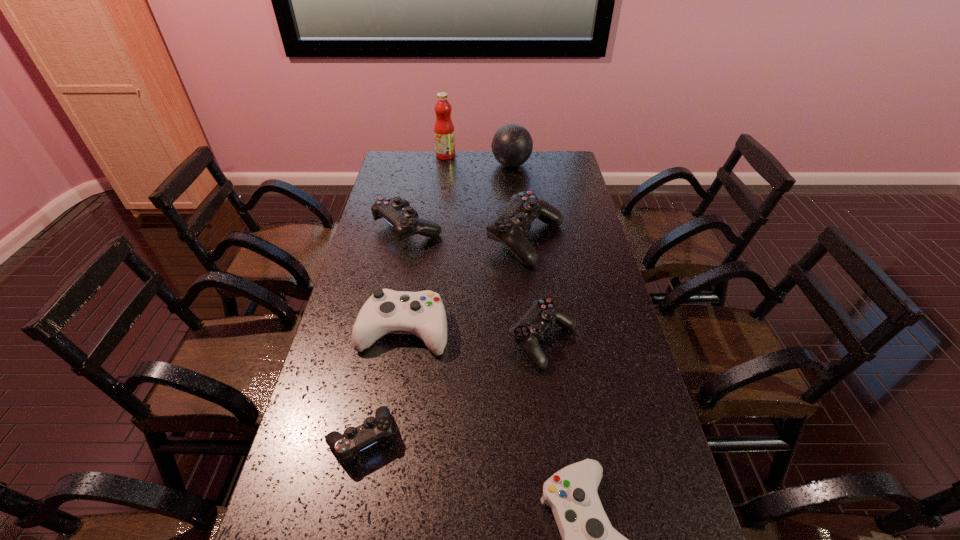
In order to click on the smallest black control in this screenshot , I will do `click(374, 429)`.

What are the coordinates of `free space located 0.220m on the front label of the fruit juice` in the screenshot? It's located at (501, 156).

The height and width of the screenshot is (540, 960). What are the coordinates of `vacant space located 0.220m on the grip area of the second tallest object` in the screenshot? It's located at (444, 165).

Where is `vacant space located on the grip area of the second tallest object`? This screenshot has height=540, width=960. vacant space located on the grip area of the second tallest object is located at coordinates (448, 165).

You are a GUI agent. You are given a task and a screenshot of the screen. Output one action in this format:
    pyautogui.click(x=<x>, y=<y>)
    Task: Click on the vacant region located 0.320m on the grip area of the second tallest object
    The width and height of the screenshot is (960, 540).
    Given the screenshot: What is the action you would take?
    pyautogui.click(x=422, y=165)

You are a GUI agent. You are given a task and a screenshot of the screen. Output one action in this format:
    pyautogui.click(x=<x>, y=<y>)
    Task: Click on the vacant space positioned on the left of the third tallest object
    Image resolution: width=960 pixels, height=540 pixels.
    Given the screenshot: What is the action you would take?
    pyautogui.click(x=392, y=240)

The width and height of the screenshot is (960, 540). In order to click on vacant space located 0.090m on the front of the second biggest black control in this screenshot , I will do tap(400, 266).

Locate an element on the screen. The image size is (960, 540). free location located on the back of the left white control is located at coordinates (413, 275).

Where is `free space located 0.050m on the right of the second nearest black control`? The image size is (960, 540). free space located 0.050m on the right of the second nearest black control is located at coordinates (595, 341).

You are a GUI agent. You are given a task and a screenshot of the screen. Output one action in this format:
    pyautogui.click(x=<x>, y=<y>)
    Task: Click on the vacant space positioned on the right of the nearest black control
    The height and width of the screenshot is (540, 960).
    Given the screenshot: What is the action you would take?
    pyautogui.click(x=495, y=438)